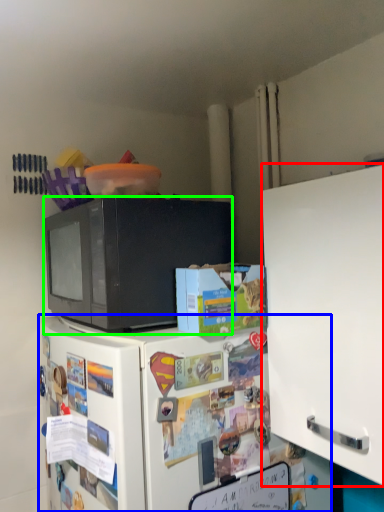
Question: Which object is the farthest from cabinetry (highlighted by a red box)? Choose among these: refrigerator (highlighted by a blue box) or microwave oven (highlighted by a green box).

Choices:
 (A) refrigerator
 (B) microwave oven

Answer: (B)